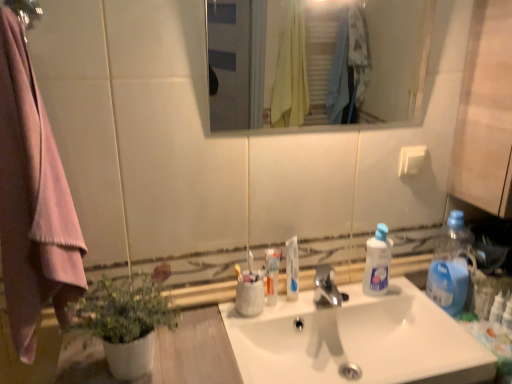
Find the location of `free location to the left of satin nickel faucet at center`. free location to the left of satin nickel faucet at center is located at coordinates (285, 315).